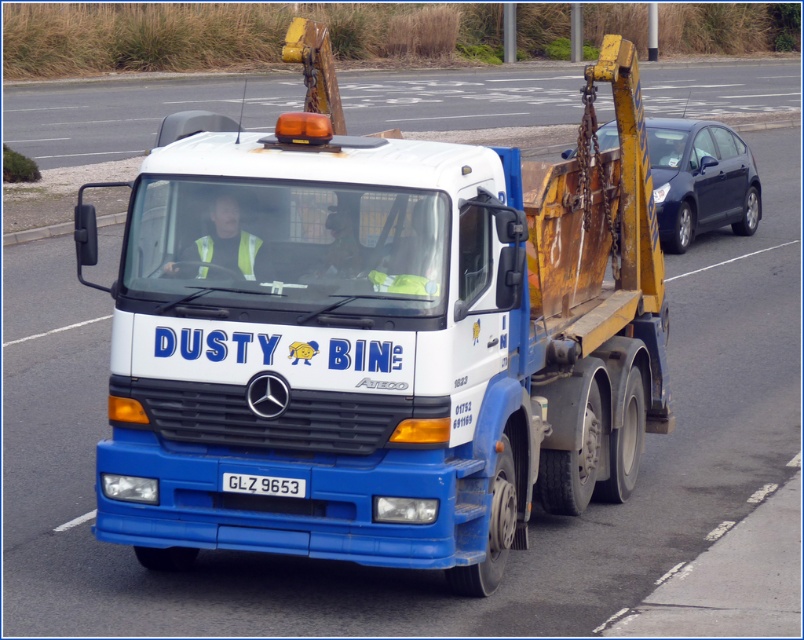
Does white glossy truck at center appear on the left side of white plastic license plate at center?

Incorrect, white glossy truck at center is not on the left side of white plastic license plate at center.

Is white glossy truck at center to the right of white plastic license plate at center from the viewer's perspective?

Indeed, white glossy truck at center is positioned on the right side of white plastic license plate at center.

Is point (113, 131) positioned in front of point (228, 486)?

No.

Where is `white glossy truck at center`? The image size is (804, 640). white glossy truck at center is located at coordinates (105, 115).

Is matte black car at right shorter than white plastic license plate at center?

No, matte black car at right is not shorter than white plastic license plate at center.

Where is `matte black car at right`? The image size is (804, 640). matte black car at right is located at coordinates (700, 179).

Does point (702, 170) come closer to viewer compared to point (232, 480)?

No, it is not.

Find the location of `matte black car at right`. matte black car at right is located at coordinates (700, 179).

Looking at this image, between blue matte tow truck at center and white glossy truck at center, which one appears on the right side from the viewer's perspective?

white glossy truck at center

Is point (228, 216) more distant than point (133, 81)?

No, it is not.

Image resolution: width=804 pixels, height=640 pixels. I want to click on blue matte tow truck at center, so click(x=380, y=336).